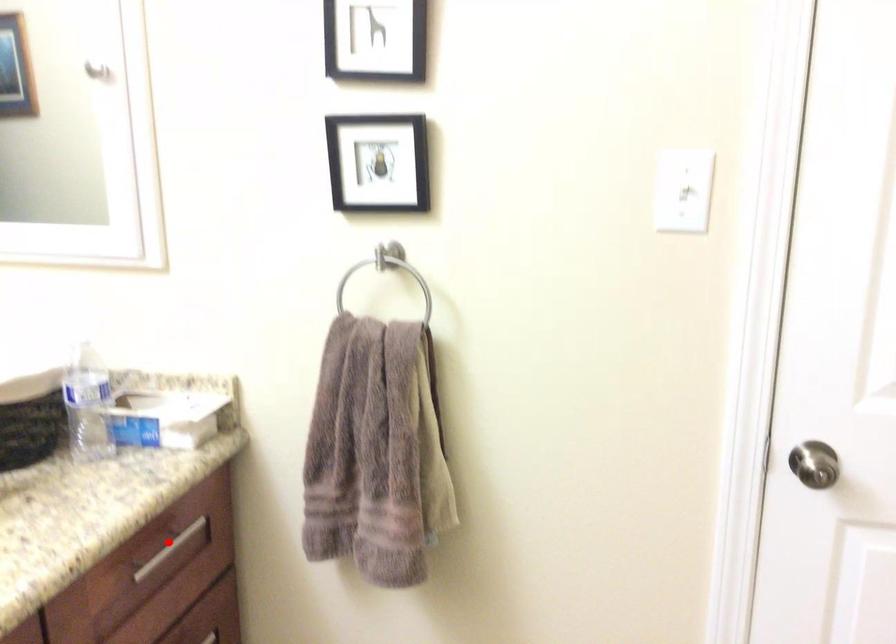
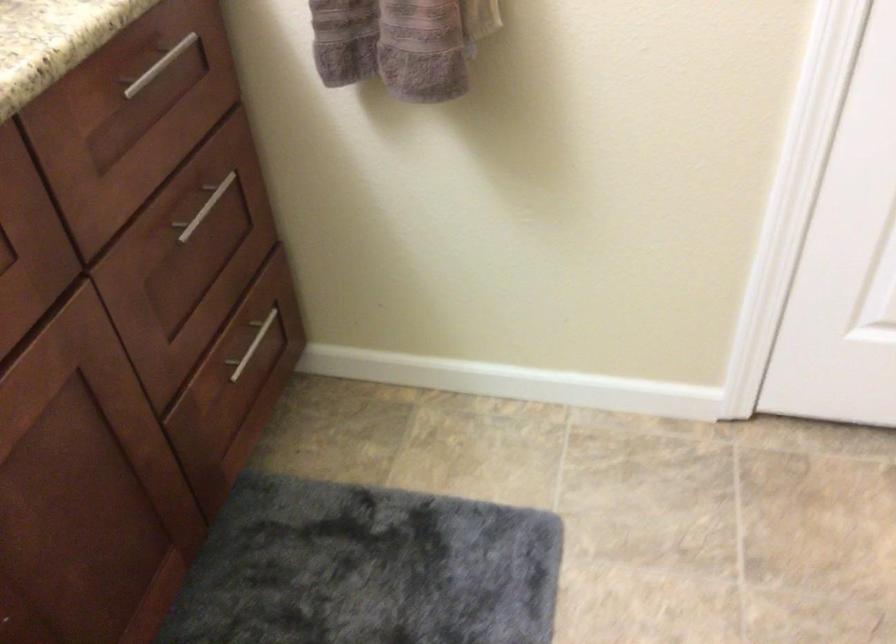
The point at the highlighted location is marked in the first image. Where is the corresponding point in the second image?

(159, 66)